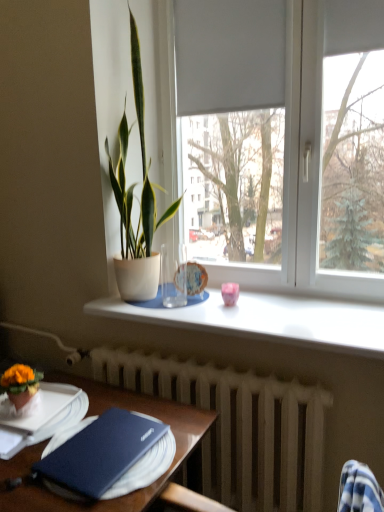
I want to click on free space in front of matte white pot at center, the second houseplant from the front, so click(x=182, y=315).